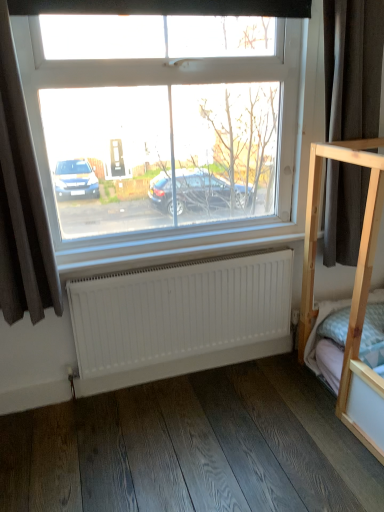
Image resolution: width=384 pixels, height=512 pixels. Identify the location of blank space situated above white matte radiator at lower center (from a real-world perspective). (181, 262).